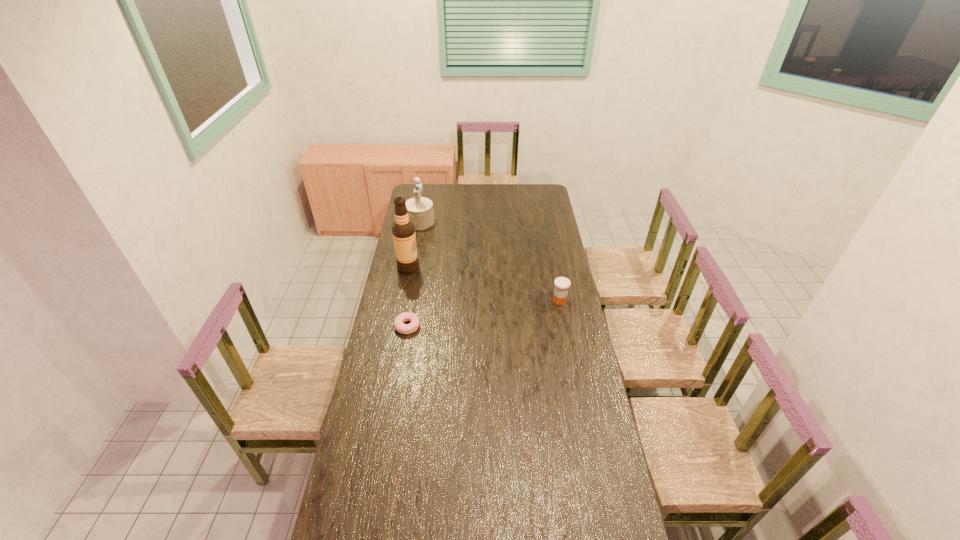
Find the location of a particular element. The width and height of the screenshot is (960, 540). vacant space at the near edge of the desktop is located at coordinates [x=464, y=515].

Image resolution: width=960 pixels, height=540 pixels. In the image, there is a desktop. Find the location of `free space at the left edge`. free space at the left edge is located at coordinates (394, 320).

At what (x,y) coordinates should I click in order to perform the action: click on free spot at the right edge of the desktop. Please return your answer as a coordinate pair (x, y). The width and height of the screenshot is (960, 540). Looking at the image, I should click on (542, 256).

Image resolution: width=960 pixels, height=540 pixels. In the image, there is a desktop. In order to click on free space at the far right corner in this screenshot , I will do `click(546, 191)`.

The height and width of the screenshot is (540, 960). In the image, there is a desktop. Identify the location of free space at the near right corner. (603, 535).

The height and width of the screenshot is (540, 960). Find the location of `vacant area between the third tallest object and the nearest object`. vacant area between the third tallest object and the nearest object is located at coordinates (484, 313).

The width and height of the screenshot is (960, 540). In order to click on free space between the shortest object and the tallest object in this screenshot , I will do `click(408, 297)`.

The height and width of the screenshot is (540, 960). Find the location of `free space that is in between the third farthest object and the nearest object`. free space that is in between the third farthest object and the nearest object is located at coordinates (484, 313).

Where is `vacant region between the third tallest object and the alcohol`? The height and width of the screenshot is (540, 960). vacant region between the third tallest object and the alcohol is located at coordinates (484, 284).

Find the location of `empty location between the farthest object and the third farthest object`. empty location between the farthest object and the third farthest object is located at coordinates (490, 261).